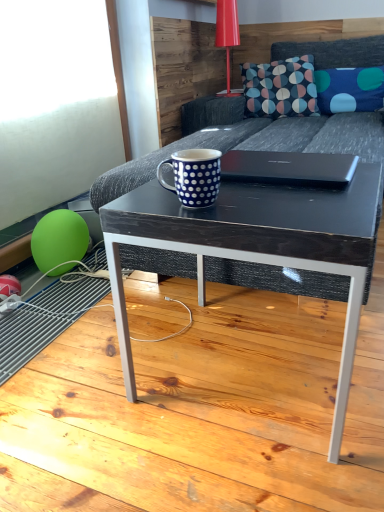
Question: Is dark blue fabric pillow with colorful circles at upper center shorter than glossy plastic table lamp at upper center?

Choices:
 (A) no
 (B) yes

Answer: (B)

Question: Are dark blue fabric pillow with colorful circles at upper center and glossy plastic table lamp at upper center far apart?

Choices:
 (A) yes
 (B) no

Answer: (B)

Question: From a real-world perspective, does dark blue fabric pillow with colorful circles at upper center stand above glossy plastic table lamp at upper center?

Choices:
 (A) no
 (B) yes

Answer: (A)

Question: From the image's perspective, is dark blue fabric pillow with colorful circles at upper center over glossy plastic table lamp at upper center?

Choices:
 (A) no
 (B) yes

Answer: (A)

Question: Is dark blue fabric pillow with colorful circles at upper center thinner than glossy plastic table lamp at upper center?

Choices:
 (A) no
 (B) yes

Answer: (A)

Question: From a real-world perspective, relative to glossy plastic table lamp at upper center, is dark gray fabric couch at center vertically above or below?

Choices:
 (A) below
 (B) above

Answer: (A)

Question: Is dark gray fabric couch at center taller or shorter than glossy plastic table lamp at upper center?

Choices:
 (A) tall
 (B) short

Answer: (A)

Question: Is dark gray fabric couch at center bigger or smaller than glossy plastic table lamp at upper center?

Choices:
 (A) big
 (B) small

Answer: (A)

Question: In the image, is dark gray fabric couch at center positioned in front of or behind glossy plastic table lamp at upper center?

Choices:
 (A) front
 (B) behind

Answer: (A)

Question: In the image, is dark blue fabric pillow with colorful circles at upper center positioned in front of or behind glossy plastic table lamp at upper center?

Choices:
 (A) front
 (B) behind

Answer: (A)

Question: In the image, is dark blue fabric pillow with colorful circles at upper center on the left side or the right side of glossy plastic table lamp at upper center?

Choices:
 (A) right
 (B) left

Answer: (A)

Question: From a real-world perspective, is dark blue fabric pillow with colorful circles at upper center positioned above or below glossy plastic table lamp at upper center?

Choices:
 (A) below
 (B) above

Answer: (A)

Question: Choose the correct answer: Is dark blue fabric pillow with colorful circles at upper center inside glossy plastic table lamp at upper center or outside it?

Choices:
 (A) inside
 (B) outside

Answer: (B)

Question: Does point (188, 159) appear closer or farther from the camera than point (236, 92)?

Choices:
 (A) closer
 (B) farther

Answer: (A)

Question: Looking at their shapes, would you say blue dotted mug at center is wider or thinner than glossy plastic table lamp at upper center?

Choices:
 (A) wide
 (B) thin

Answer: (B)